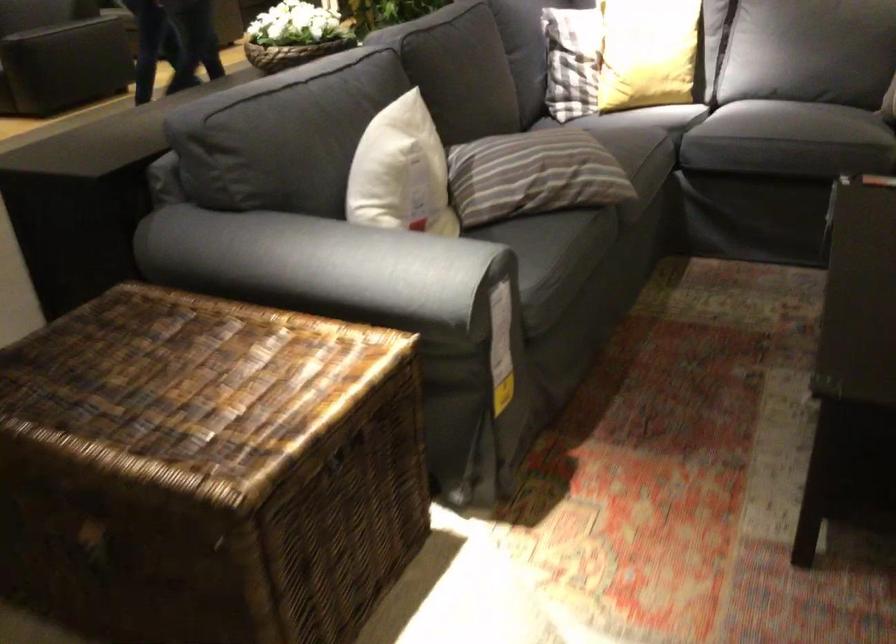
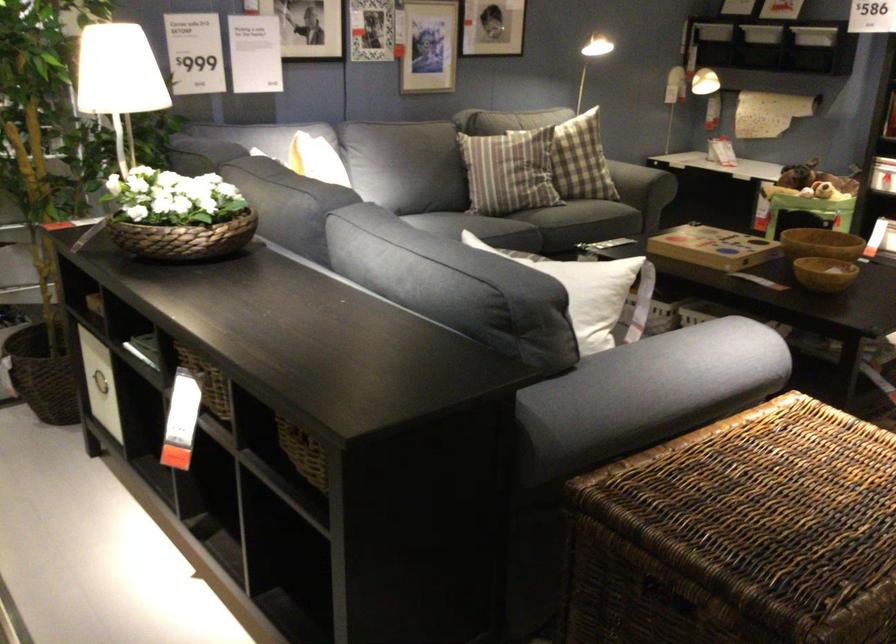
In the second image, find the point that corresponds to point (273, 292) in the first image.

(647, 393)